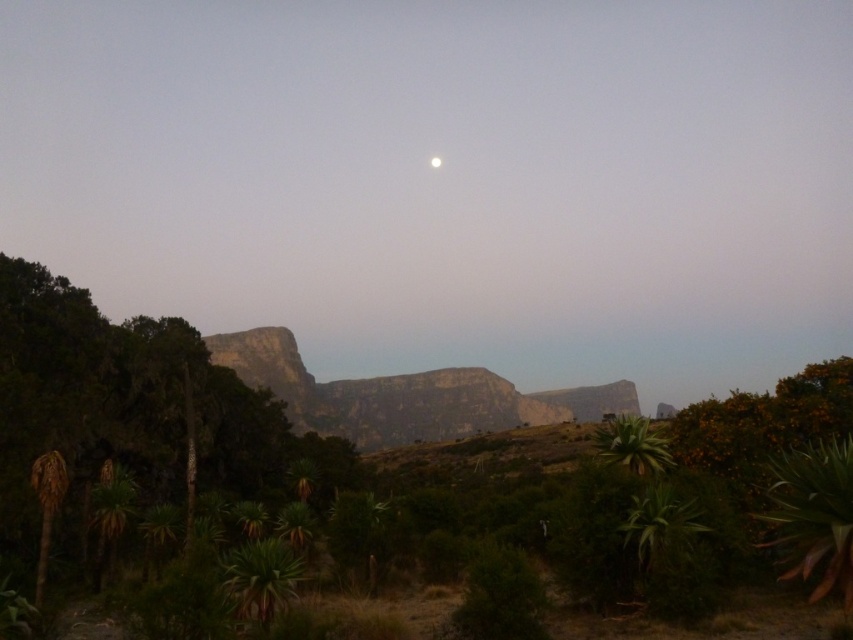
In the scene shown: You are a hiker planning to walk from the rocky cliff at center to the green leafy plant at lower right. Based on the distance between them, can you estimate how long it would take you to walk this path if your average walking speed is 3.5 km per hour?

The rocky cliff at center and green leafy plant at lower right are 159.37 meters apart. At an average walking speed of 3.5 km per hour, it would take approximately 28.8 minutes to cover this distance. This is calculated by converting 3.5 km to meters per minute, which is about 58.3 meters per minute, and dividing the distance by that rate.